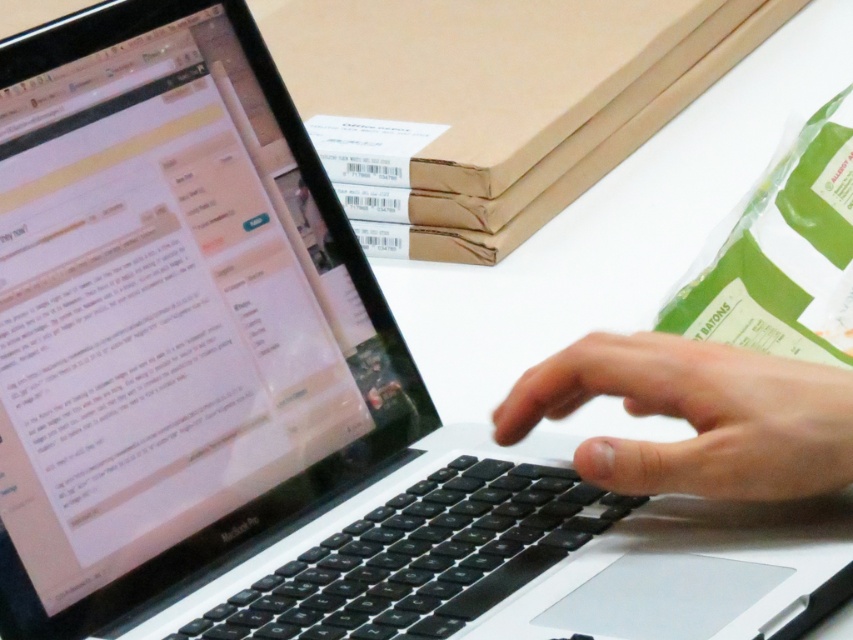
Can you confirm if black matte laptop at left is wider than black matte hand at center?

Indeed, black matte laptop at left has a greater width compared to black matte hand at center.

Who is higher up, black matte laptop at left or black matte hand at center?

black matte laptop at left is above.

Which is behind, point (85, 202) or point (791, 372)?

The point (85, 202) is more distant.

You are a GUI agent. You are given a task and a screenshot of the screen. Output one action in this format:
    pyautogui.click(x=<x>, y=<y>)
    Task: Click on the black matte laptop at left
    The height and width of the screenshot is (640, 853).
    Given the screenshot: What is the action you would take?
    pyautogui.click(x=172, y=317)

You are a GUI agent. You are given a task and a screenshot of the screen. Output one action in this format:
    pyautogui.click(x=<x>, y=<y>)
    Task: Click on the black matte laptop at left
    This screenshot has width=853, height=640.
    Given the screenshot: What is the action you would take?
    pyautogui.click(x=172, y=317)

Can you confirm if black matte laptop at left is positioned to the left of black matte keyboard at center?

Yes, black matte laptop at left is to the left of black matte keyboard at center.

Which is in front, point (61, 508) or point (463, 605)?

Positioned in front is point (463, 605).

At what (x,y) coordinates should I click in order to perform the action: click on black matte laptop at left. Please return your answer as a coordinate pair (x, y). Looking at the image, I should click on (172, 317).

Is black matte keyboard at center in front of black matte hand at center?

No.

Is black matte keyboard at center wider than black matte hand at center?

Yes.

Does point (581, 486) come behind point (670, 477)?

Yes, point (581, 486) is behind point (670, 477).

Where is `black matte keyboard at center`? Image resolution: width=853 pixels, height=640 pixels. black matte keyboard at center is located at coordinates (422, 557).